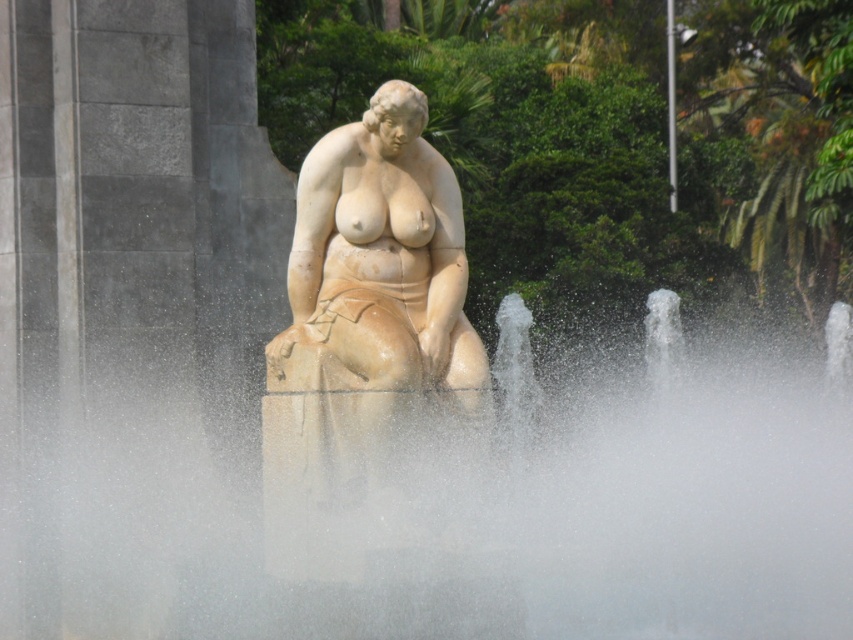
Which is behind, point (236, 621) or point (374, 113)?

Point (374, 113)

Between white frothy water at center and white marble statue at center, which one appears on the right side from the viewer's perspective?

From the viewer's perspective, white frothy water at center appears more on the right side.

Is point (666, 477) positioned after point (345, 550)?

Yes.

What are the coordinates of `white frothy water at center` in the screenshot? It's located at (459, 508).